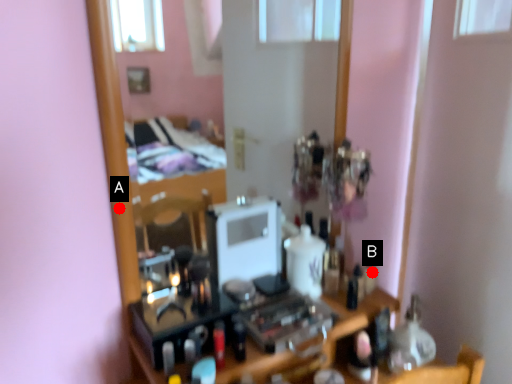
Question: Two points are circled on the image, labeled by A and B beside each circle. Which of the following is the farthest from the observer?

Choices:
 (A) A is further
 (B) B is further

Answer: (B)